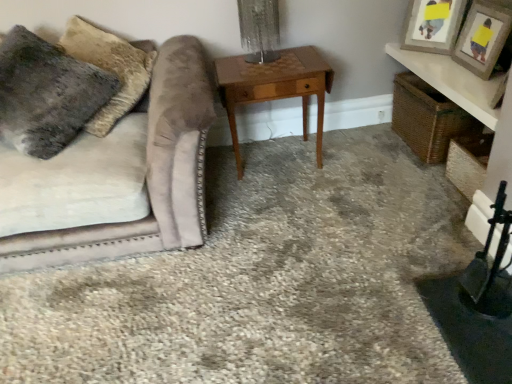
Question: Is fuzzy gray pillow at upper left positioned with its back to wooden picture frame at upper right, which is the 1th picture frame in front-to-back order?

Choices:
 (A) no
 (B) yes

Answer: (A)

Question: Is fuzzy gray pillow at upper left positioned before wooden picture frame at upper right, which is the 1th picture frame in front-to-back order?

Choices:
 (A) no
 (B) yes

Answer: (B)

Question: Is fuzzy gray pillow at upper left thinner than wooden picture frame at upper right, placed as the second picture frame when sorted from back to front?

Choices:
 (A) no
 (B) yes

Answer: (A)

Question: From the image's perspective, does fuzzy gray pillow at upper left appear higher than wooden picture frame at upper right, which is the 1th picture frame in front-to-back order?

Choices:
 (A) no
 (B) yes

Answer: (A)

Question: Is fuzzy gray pillow at upper left located outside wooden picture frame at upper right, which is the 1th picture frame in front-to-back order?

Choices:
 (A) no
 (B) yes

Answer: (B)

Question: In terms of size, does wooden picture frame at upper right, which ranks as the 2th picture frame in front-to-back order, appear bigger or smaller than velvet beige couch at left?

Choices:
 (A) big
 (B) small

Answer: (B)

Question: Would you say wooden picture frame at upper right, which ranks as the 2th picture frame in front-to-back order, is inside or outside velvet beige couch at left?

Choices:
 (A) outside
 (B) inside

Answer: (A)

Question: In terms of width, does wooden picture frame at upper right, marked as the first picture frame in a back-to-front arrangement, look wider or thinner when compared to velvet beige couch at left?

Choices:
 (A) wide
 (B) thin

Answer: (B)

Question: From the image's perspective, is wooden picture frame at upper right, marked as the first picture frame in a back-to-front arrangement, above or below velvet beige couch at left?

Choices:
 (A) below
 (B) above

Answer: (B)

Question: Is light brown wood table at center in front of or behind velvet beige couch at left in the image?

Choices:
 (A) front
 (B) behind

Answer: (B)

Question: Considering the positions of light brown wood table at center and velvet beige couch at left in the image, is light brown wood table at center bigger or smaller than velvet beige couch at left?

Choices:
 (A) big
 (B) small

Answer: (B)

Question: Is light brown wood table at center inside the boundaries of velvet beige couch at left, or outside?

Choices:
 (A) outside
 (B) inside

Answer: (A)

Question: Considering the positions of point (302, 97) and point (4, 256), is point (302, 97) closer or farther from the camera than point (4, 256)?

Choices:
 (A) farther
 (B) closer

Answer: (A)

Question: Is wooden picture frame at upper right, marked as the first picture frame in a back-to-front arrangement, to the left or to the right of wooden picture frame at upper right, placed as the second picture frame when sorted from back to front, in the image?

Choices:
 (A) left
 (B) right

Answer: (A)

Question: Which is correct: wooden picture frame at upper right, marked as the first picture frame in a back-to-front arrangement, is inside wooden picture frame at upper right, placed as the second picture frame when sorted from back to front, or outside of it?

Choices:
 (A) inside
 (B) outside

Answer: (B)